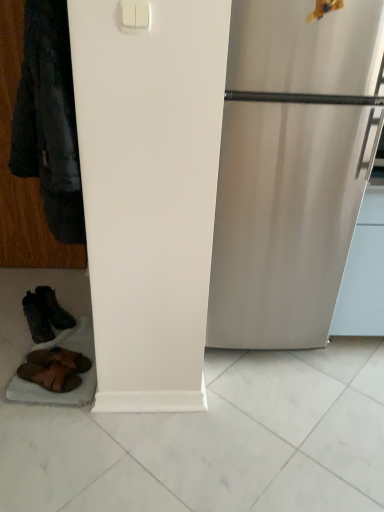
Question: From a real-world perspective, is dark brown leather boots at lower left, the 1th footwear viewed from the back, on top of white plastic light switch at upper center?

Choices:
 (A) no
 (B) yes

Answer: (A)

Question: Considering the relative sizes of dark brown leather boots at lower left, the 1th footwear viewed from the back, and white plastic light switch at upper center in the image provided, is dark brown leather boots at lower left, the 1th footwear viewed from the back, bigger than white plastic light switch at upper center?

Choices:
 (A) yes
 (B) no

Answer: (A)

Question: Is dark brown leather boots at lower left, the 3th footwear from the front, further to camera compared to white plastic light switch at upper center?

Choices:
 (A) yes
 (B) no

Answer: (A)

Question: From the image's perspective, is dark brown leather boots at lower left, the 1th footwear viewed from the back, located beneath white plastic light switch at upper center?

Choices:
 (A) yes
 (B) no

Answer: (A)

Question: From the image's perspective, is dark brown leather boots at lower left, the 1th footwear viewed from the back, over white plastic light switch at upper center?

Choices:
 (A) yes
 (B) no

Answer: (B)

Question: Is dark brown leather boots at lower left, the 3th footwear from the front, looking in the opposite direction of white plastic light switch at upper center?

Choices:
 (A) no
 (B) yes

Answer: (A)

Question: Is brown leather sandals at lower left, which ranks as the third footwear in back-to-front order, further to the viewer compared to brown leather sandals at lower left, the second footwear from the front?

Choices:
 (A) no
 (B) yes

Answer: (A)

Question: Is brown leather sandals at lower left, which ranks as the third footwear in back-to-front order, located outside brown leather sandals at lower left, which ranks as the second footwear in back-to-front order?

Choices:
 (A) yes
 (B) no

Answer: (A)

Question: Is brown leather sandals at lower left, placed as the first footwear when sorted from front to back, facing away from brown leather sandals at lower left, the second footwear from the front?

Choices:
 (A) no
 (B) yes

Answer: (A)

Question: Does brown leather sandals at lower left, which ranks as the third footwear in back-to-front order, have a greater height compared to brown leather sandals at lower left, which ranks as the second footwear in back-to-front order?

Choices:
 (A) yes
 (B) no

Answer: (B)

Question: Could you tell me if brown leather sandals at lower left, placed as the first footwear when sorted from front to back, is facing brown leather sandals at lower left, the second footwear from the front?

Choices:
 (A) no
 (B) yes

Answer: (A)

Question: Can you confirm if brown leather sandals at lower left, placed as the first footwear when sorted from front to back, is thinner than brown leather sandals at lower left, which ranks as the second footwear in back-to-front order?

Choices:
 (A) no
 (B) yes

Answer: (A)

Question: From the image's perspective, does brown leather sandals at lower left, placed as the first footwear when sorted from front to back, appear higher than dark brown leather boots at lower left, the 1th footwear viewed from the back?

Choices:
 (A) no
 (B) yes

Answer: (A)